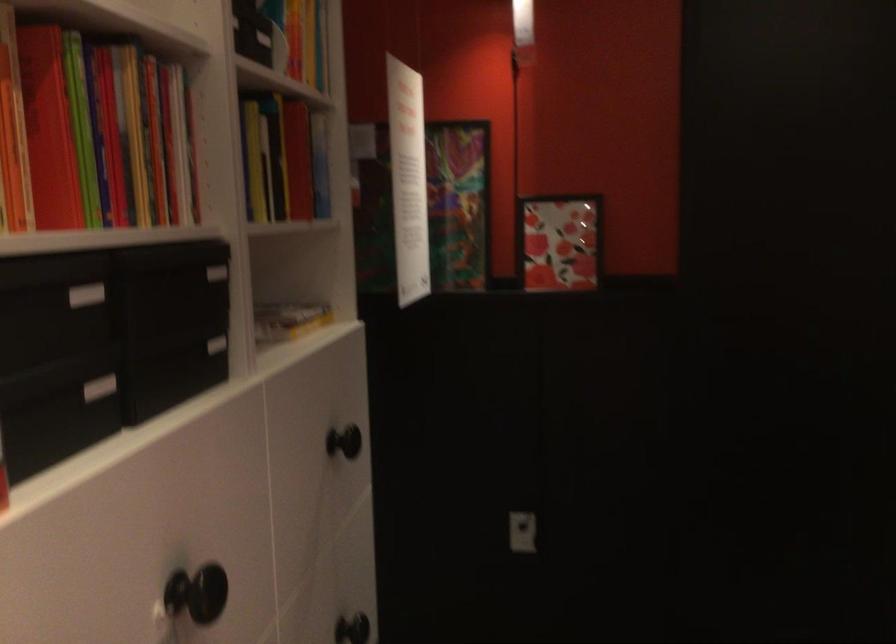
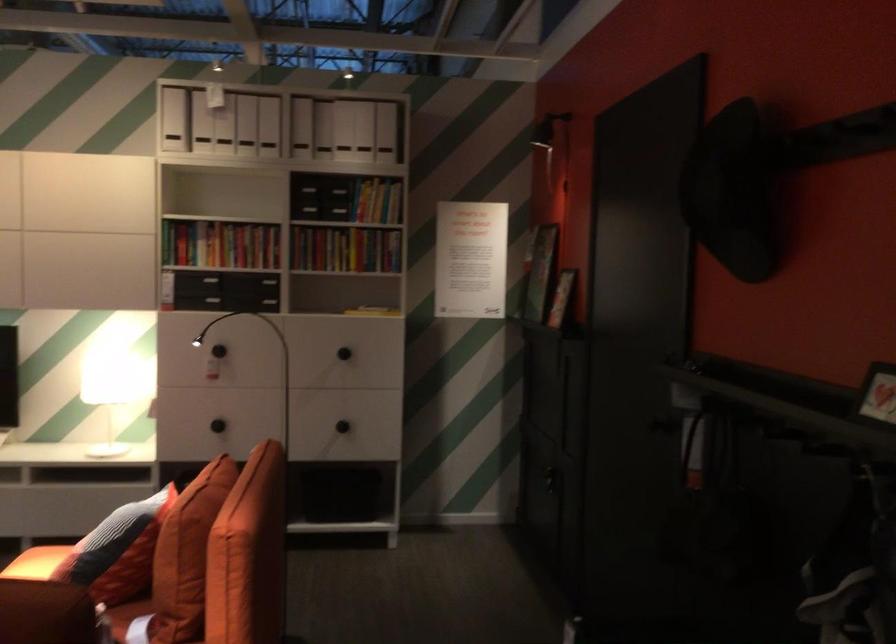
Locate, in the second image, the point that corresponds to (366,455) in the first image.

(343, 353)